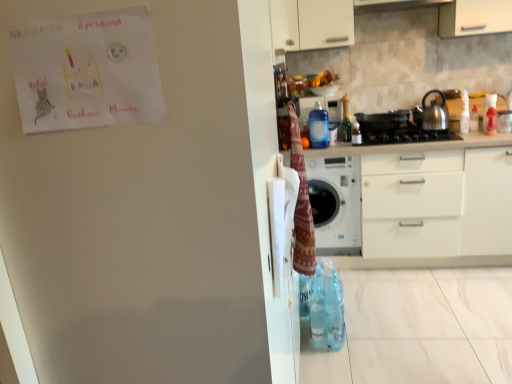
At what (x,y) coordinates should I click in order to perform the action: click on unoccupied area in front of white glossy washing machine at center. Please return your answer as a coordinate pair (x, y). This screenshot has height=384, width=512. Looking at the image, I should click on (377, 286).